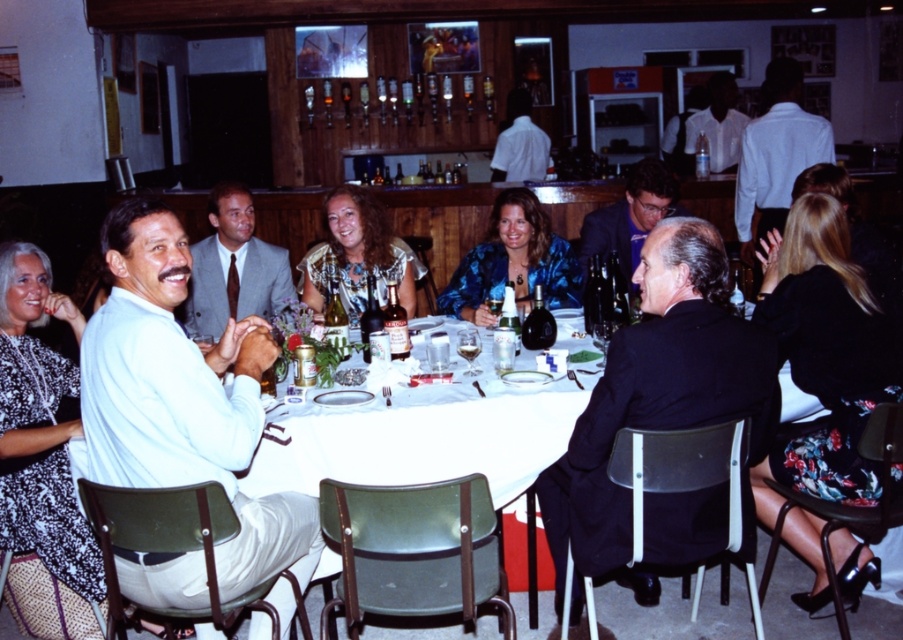
Question: Can you confirm if white plastic table at center is positioned to the left of patterned fabric blouse at center?

Choices:
 (A) no
 (B) yes

Answer: (A)

Question: Among these points, which one is nearest to the camera?

Choices:
 (A) (411, 429)
 (B) (362, 262)
 (C) (447, 305)

Answer: (A)

Question: Does blue textured jacket at center appear under patterned fabric blouse at center?

Choices:
 (A) no
 (B) yes

Answer: (B)

Question: Which point is farther to the camera?

Choices:
 (A) white plastic table at center
 (B) patterned fabric blouse at center

Answer: (B)

Question: Is white plastic table at center to the left of blue textured jacket at center from the viewer's perspective?

Choices:
 (A) yes
 (B) no

Answer: (A)

Question: Which of the following is the farthest from the observer?

Choices:
 (A) blue textured jacket at center
 (B) patterned fabric blouse at center
 (C) white plastic table at center

Answer: (B)